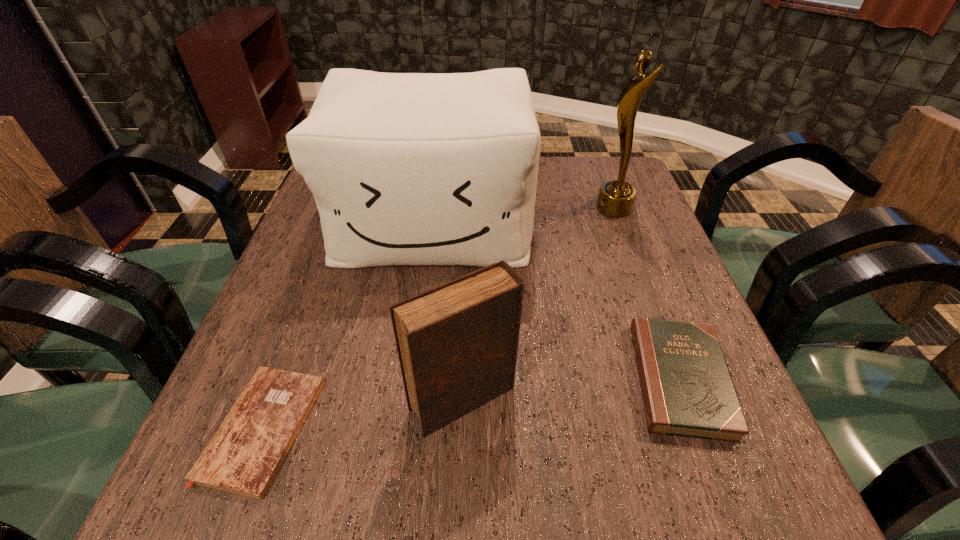
Where is `award`? Image resolution: width=960 pixels, height=540 pixels. award is located at coordinates (616, 198).

Where is `cushion`? The height and width of the screenshot is (540, 960). cushion is located at coordinates (406, 168).

The width and height of the screenshot is (960, 540). In order to click on the third shortest object in this screenshot , I will do pyautogui.click(x=457, y=343).

Find the location of a particular element. This screenshot has width=960, height=540. the second Bible from left to right is located at coordinates (457, 343).

This screenshot has width=960, height=540. What are the coordinates of `the rightmost Bible` in the screenshot? It's located at (687, 390).

Locate an element on the screen. This screenshot has width=960, height=540. the second shortest Bible is located at coordinates (687, 390).

Locate an element on the screen. The image size is (960, 540). the shortest object is located at coordinates (244, 455).

The image size is (960, 540). Find the location of `the leftmost Bible`. the leftmost Bible is located at coordinates (244, 455).

I want to click on vacant position located 0.230m on the front-facing side of the award, so click(507, 208).

You are a GUI agent. You are given a task and a screenshot of the screen. Output one action in this format:
    pyautogui.click(x=<x>, y=<y>)
    Task: Click on the free space located on the front-facing side of the award
    
    Given the screenshot: What is the action you would take?
    pyautogui.click(x=468, y=208)